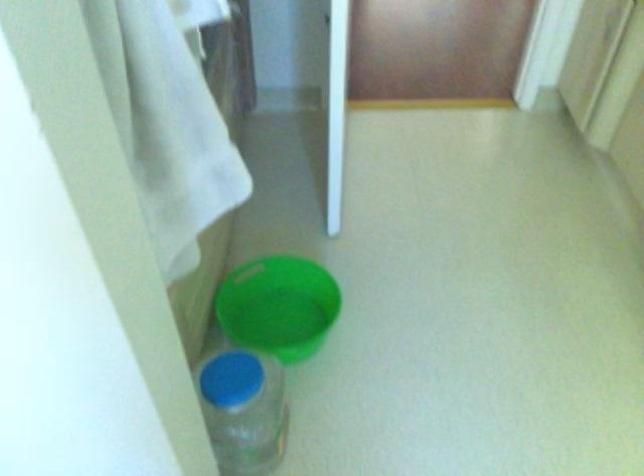
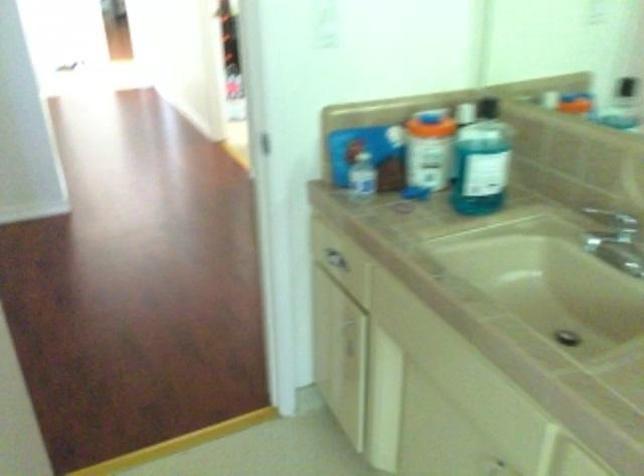
The images are taken continuously from a first-person perspective. In which direction is your viewpoint rotating?

The rotation direction of the camera is right-up.